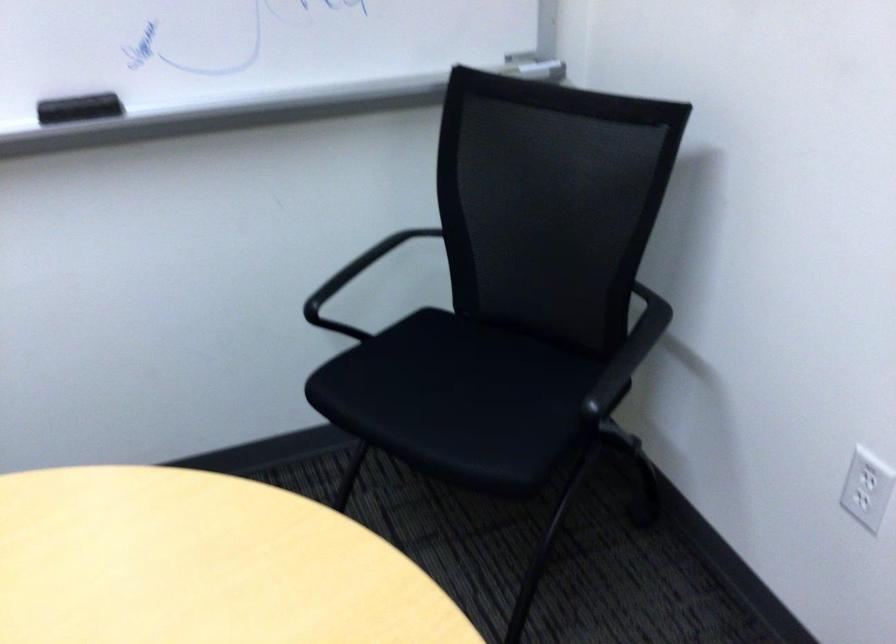
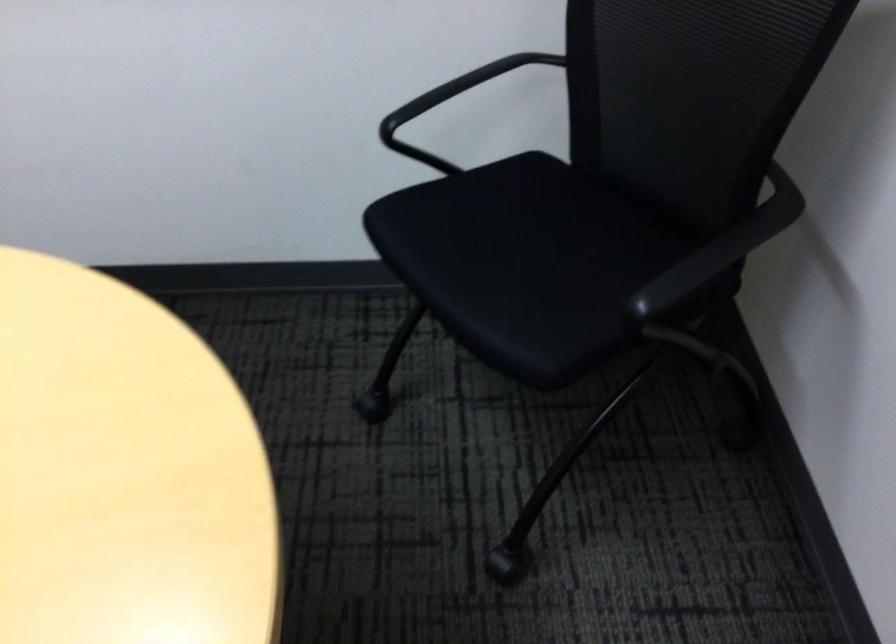
Question: The camera is either moving clockwise (left) or counter-clockwise (right) around the object. The first image is from the beginning of the video and the second image is from the end. Is the camera moving left or right when shooting the video?

Choices:
 (A) Left
 (B) Right

Answer: (B)